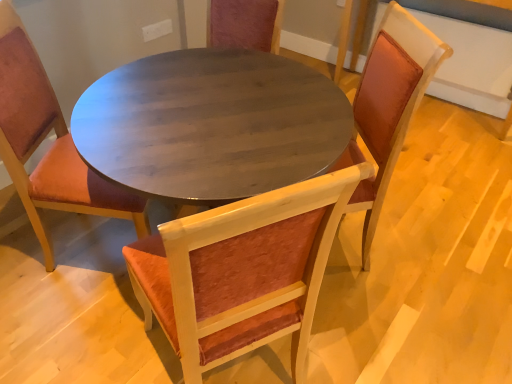
I want to click on free space in front of velvet orange chair at center, which ranks as the first chair in right-to-left order, so click(364, 331).